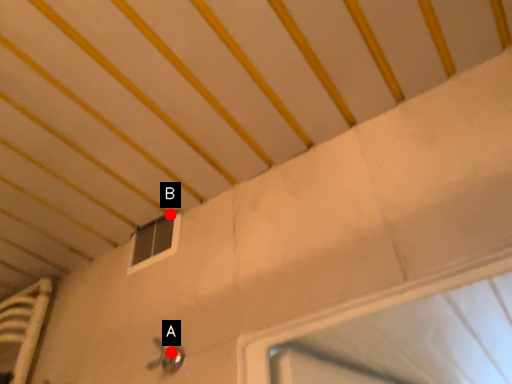
Question: Two points are circled on the image, labeled by A and B beside each circle. Which of the following is the farthest from the observer?

Choices:
 (A) A is further
 (B) B is further

Answer: (B)